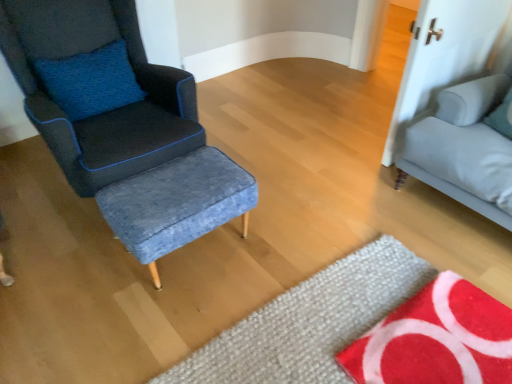
At what (x,y) coordinates should I click in order to perform the action: click on vacant space to the left of light gray fabric studio couch at right. Please return your answer as a coordinate pair (x, y). This screenshot has height=384, width=512. Looking at the image, I should click on (336, 185).